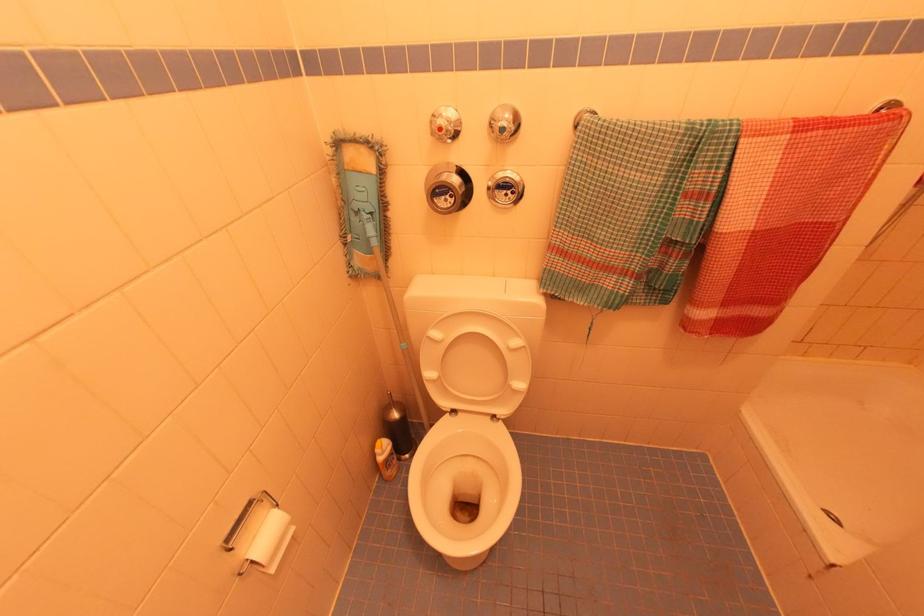
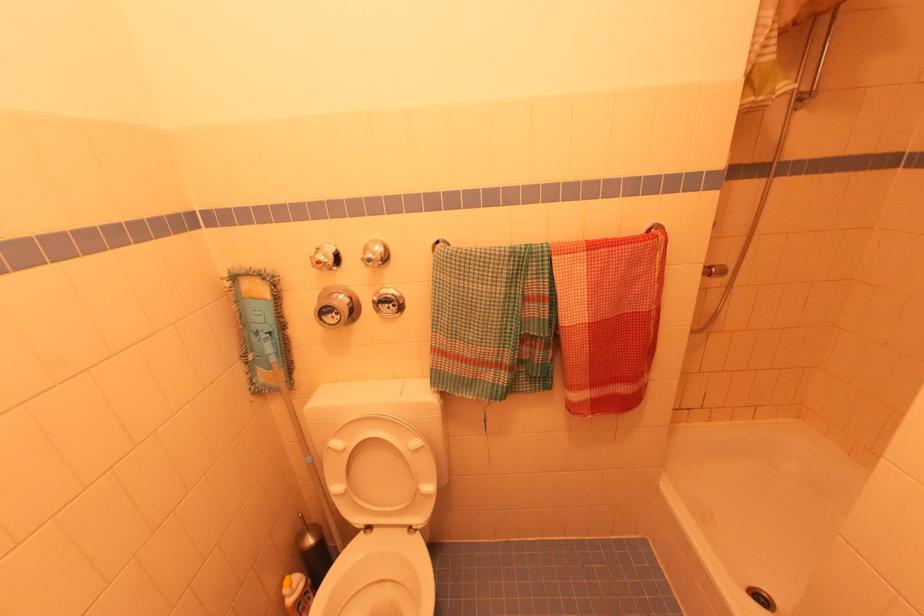
Find the pixel in the second image that matches (391,246) in the first image.

(293, 361)